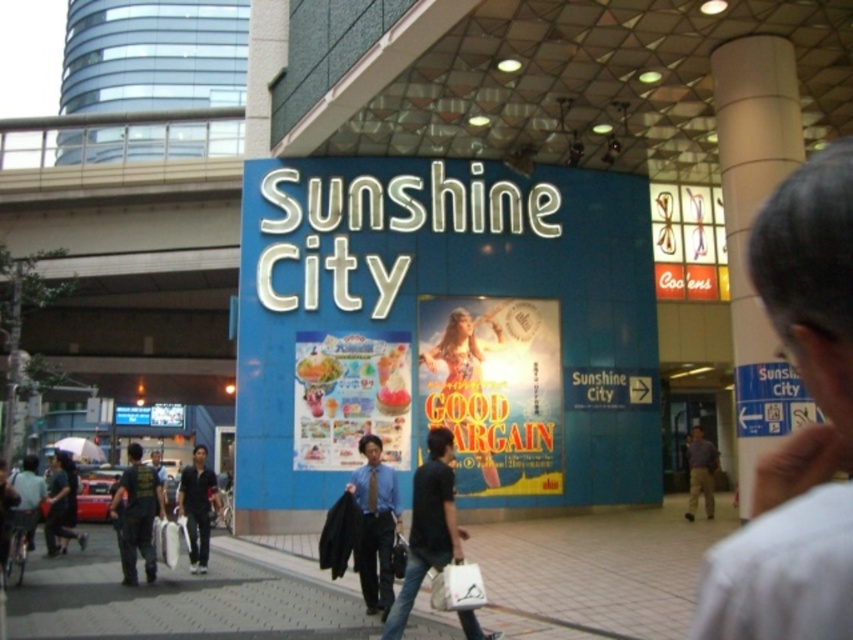
Question: Which point is closer to the camera?

Choices:
 (A) light brown shirt at center
 (B) matte plastic poster at center
 (C) dark blue shirt at center
 (D) white fabric bag at center

Answer: (D)

Question: Which is farther from the dark blue shirt at center?

Choices:
 (A) light brown shirt at center
 (B) yellow paper poster at center
 (C) dark blue uniform at center

Answer: (A)

Question: Does blue glossy signboard at center have a lesser width compared to gray hair at upper right?

Choices:
 (A) yes
 (B) no

Answer: (B)

Question: Can you confirm if blue glossy signboard at center is bigger than yellow paper poster at center?

Choices:
 (A) no
 (B) yes

Answer: (B)

Question: Which is farther from the blue glossy signboard at center?

Choices:
 (A) dark blue shirt at center
 (B) light brown shirt at center

Answer: (A)

Question: Does gray hair at upper right have a lesser width compared to matte plastic poster at center?

Choices:
 (A) no
 (B) yes

Answer: (A)